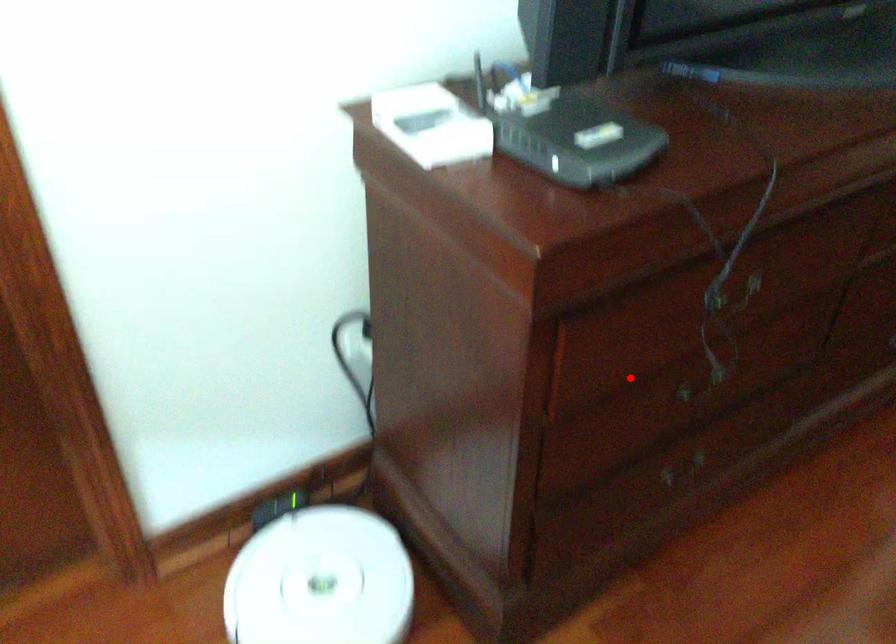
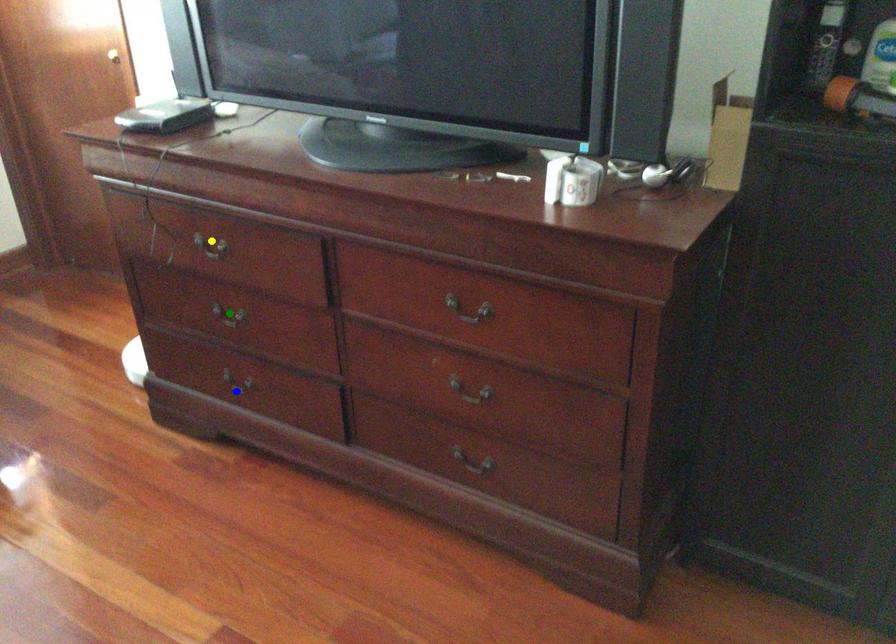
Question: I am providing you with two images of the same scene from different viewpoints. A red point is marked on the first image. You are given multiple points on the second image. In image 2, which mark is for the same physical point as the one in image 1?

Choices:
 (A) yellow point
 (B) blue point
 (C) green point

Answer: (C)